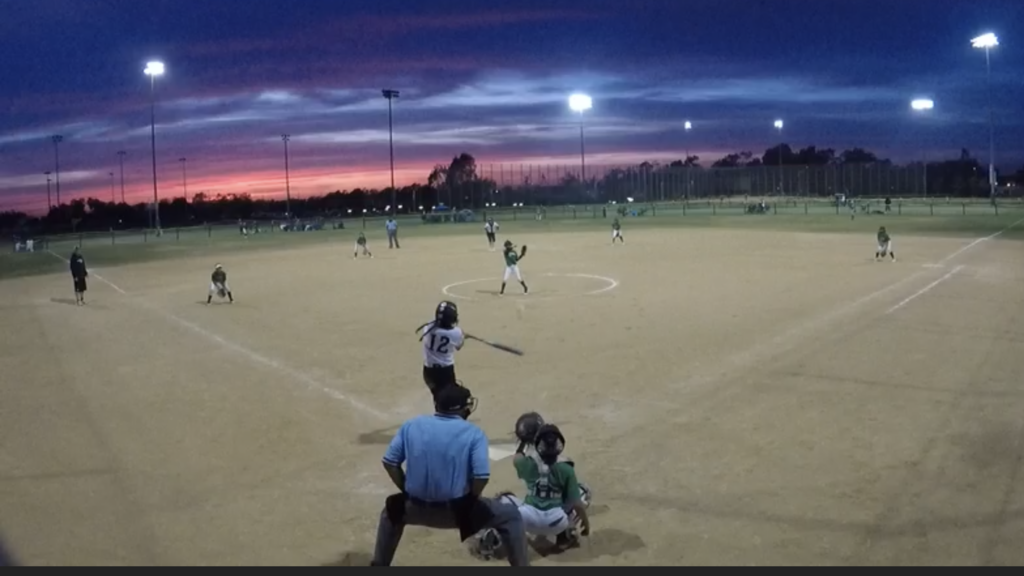
This screenshot has width=1024, height=576. Find the location of `light`. light is located at coordinates 989,37.